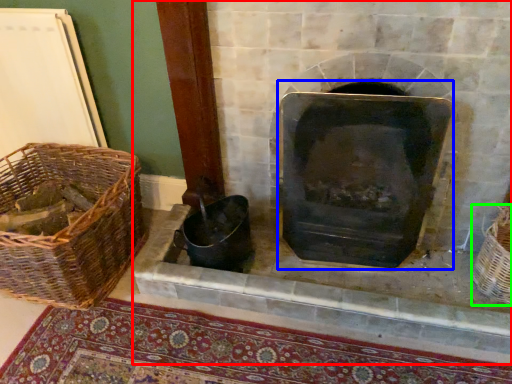
Question: Which is nearer to the fireplace (highlighted by a red box)? wood burning stove (highlighted by a blue box) or basket (highlighted by a green box).

Choices:
 (A) wood burning stove
 (B) basket

Answer: (A)